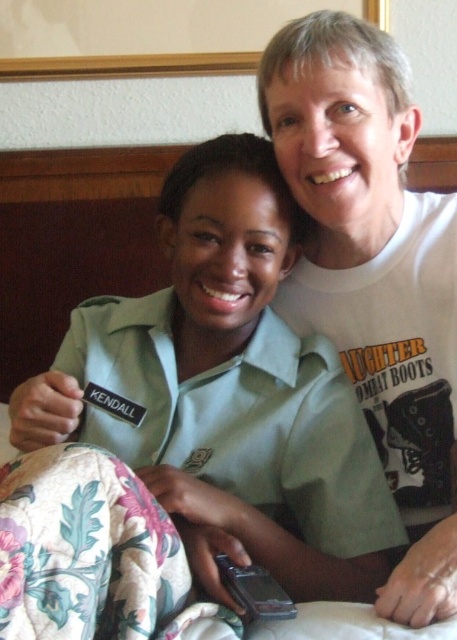
Does green uniform shirt at center have a lesser width compared to white cotton t-shirt at upper right?

Incorrect, green uniform shirt at center's width is not less than white cotton t-shirt at upper right's.

Who is positioned more to the right, green uniform shirt at center or white cotton t-shirt at upper right?

Positioned to the right is white cotton t-shirt at upper right.

Does point (233, 369) lie in front of point (371, 77)?

That is False.

You are a GUI agent. You are given a task and a screenshot of the screen. Output one action in this format:
    pyautogui.click(x=<x>, y=<y>)
    Task: Click on the green uniform shirt at center
    
    Given the screenshot: What is the action you would take?
    pyautogui.click(x=226, y=392)